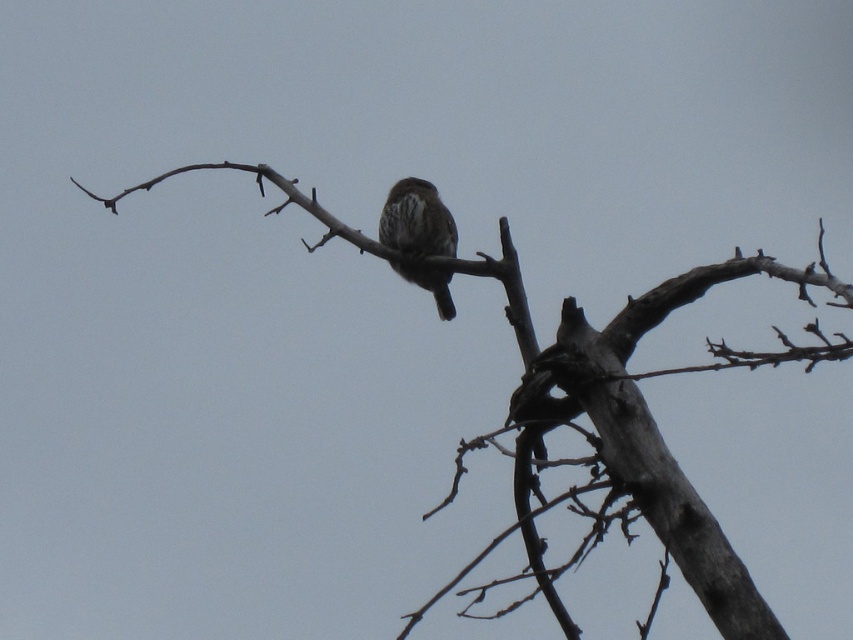
Question: Which point appears closest to the camera in this image?

Choices:
 (A) (410, 214)
 (B) (589, 515)

Answer: (B)

Question: Where is brown textured branch at center located in relation to brown speckled bird at center in the image?

Choices:
 (A) right
 (B) left

Answer: (A)

Question: Which point appears farthest from the camera in this image?

Choices:
 (A) (399, 192)
 (B) (527, 323)

Answer: (A)

Question: Can you confirm if brown textured branch at center is thinner than brown speckled bird at center?

Choices:
 (A) yes
 (B) no

Answer: (B)

Question: Can you confirm if brown textured branch at center is positioned below brown speckled bird at center?

Choices:
 (A) no
 (B) yes

Answer: (B)